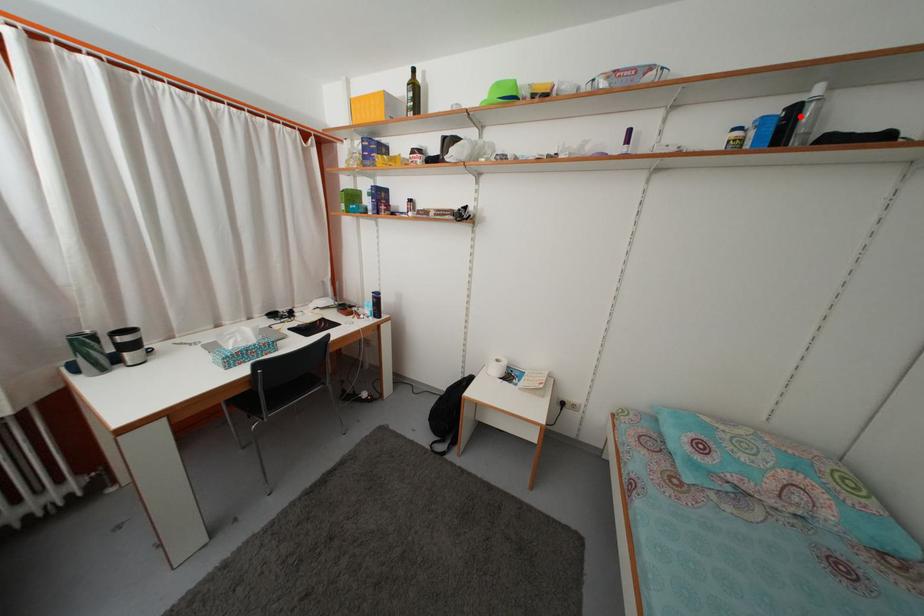
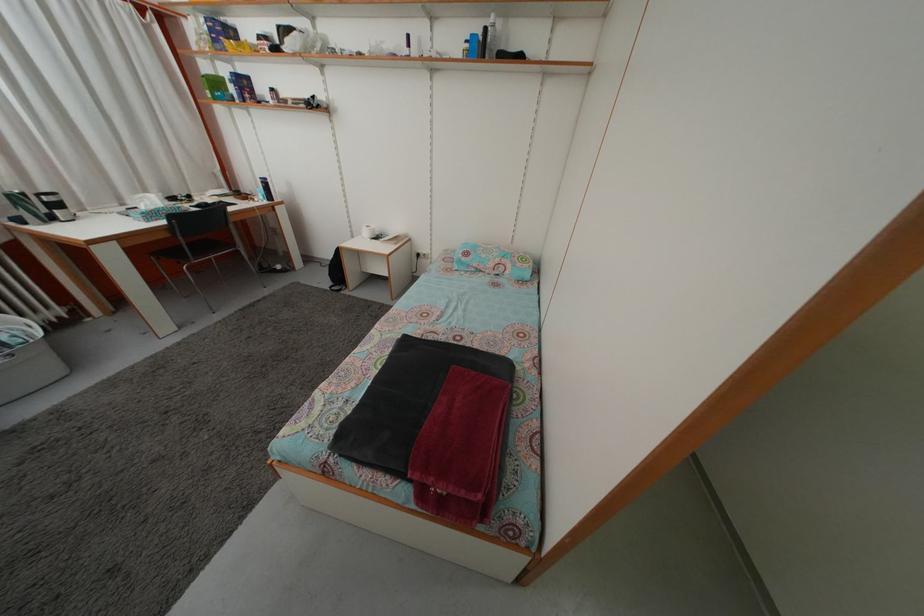
Find the pixel in the second image that matches the highlighted location in the first image.

(492, 38)